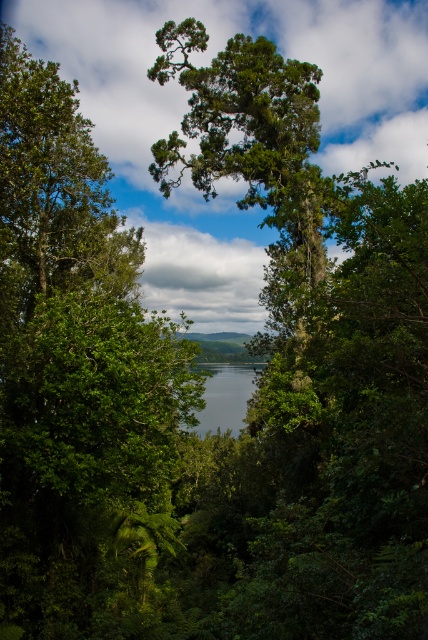
Question: Which object is closer to the camera taking this photo?

Choices:
 (A) green matte tree at center
 (B) clear water at center

Answer: (A)

Question: Is green matte tree at center to the left of clear water at center from the viewer's perspective?

Choices:
 (A) yes
 (B) no

Answer: (B)

Question: Which point is closer to the camera taking this photo?

Choices:
 (A) (219, 369)
 (B) (258, 42)

Answer: (B)

Question: Can you confirm if green matte tree at center is thinner than clear water at center?

Choices:
 (A) no
 (B) yes

Answer: (B)

Question: Can you confirm if green matte tree at center is positioned to the left of clear water at center?

Choices:
 (A) no
 (B) yes

Answer: (A)